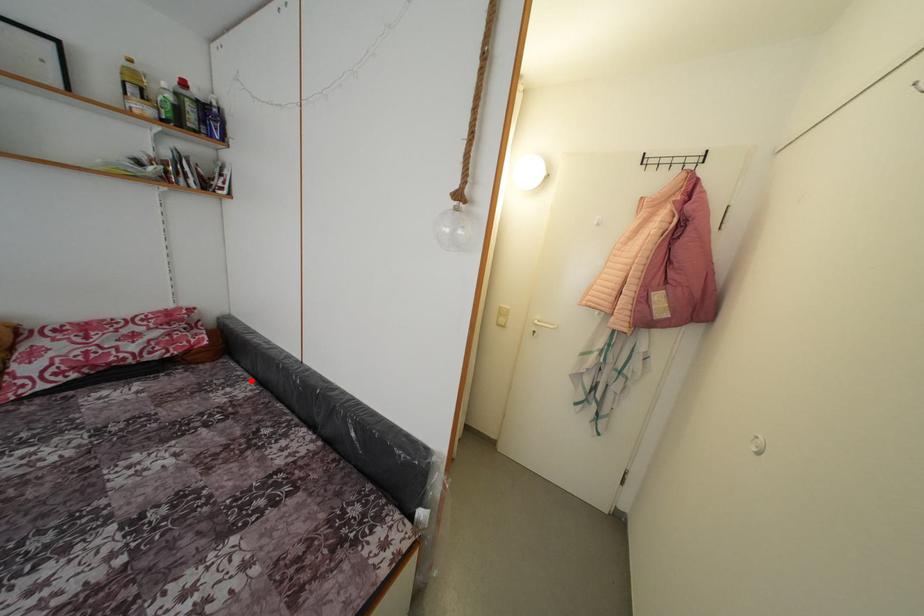
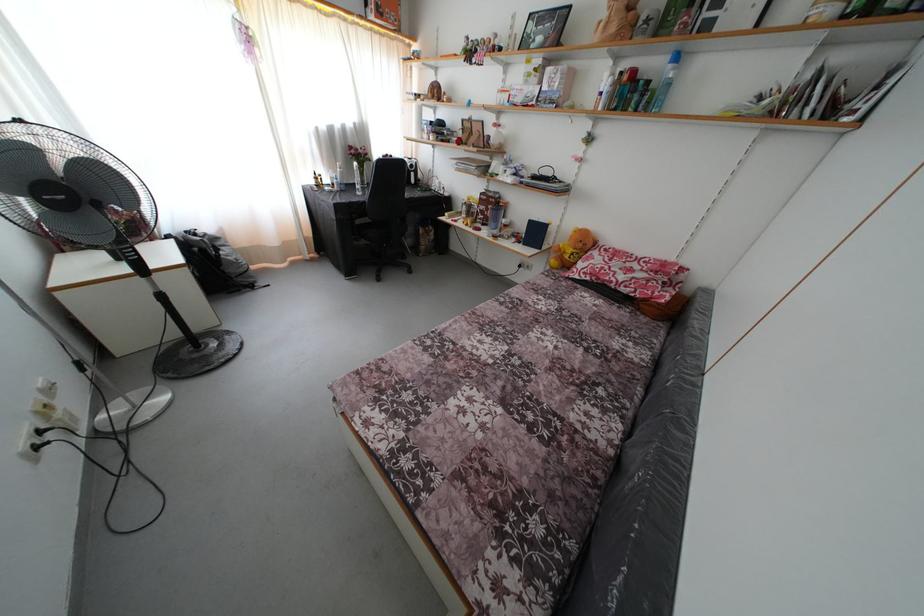
Question: A red point is marked in image1. In image2, is the corresponding 3D point closer to the camera or farther? Reply with the corresponding letter.

Choices:
 (A) The corresponding 3D point is closer.
 (B) The corresponding 3D point is farther.

Answer: (A)